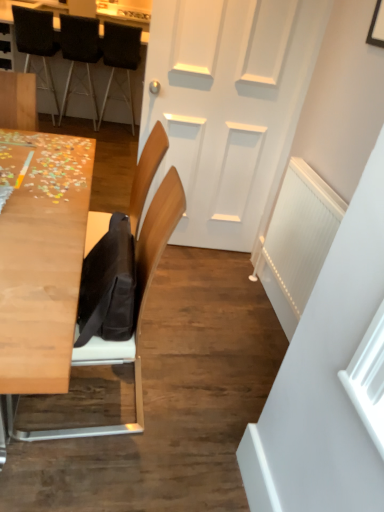
This screenshot has width=384, height=512. What do you see at coordinates (227, 105) in the screenshot?
I see `white matte door at center` at bounding box center [227, 105].

In the scene shown: Measure the distance between point (54, 231) and camera.

Point (54, 231) is 1.41 meters away from camera.

The image size is (384, 512). I want to click on white plastic radiator at right, so click(298, 241).

The height and width of the screenshot is (512, 384). In order to click on wooden puzzle pieces at upper left, the first table viewed from the top in this screenshot , I will do `click(79, 94)`.

What is the approximate height of wooden puzzle pieces at upper left, the first table viewed from the top?

The height of wooden puzzle pieces at upper left, the first table viewed from the top, is 37.06 inches.

The width and height of the screenshot is (384, 512). What are the coordinates of `white matte door at center` in the screenshot? It's located at (227, 105).

Is white plastic radiator at right at the back of wooden chair at left, which is counted as the fourth chair, starting from the back?

wooden chair at left, which is counted as the fourth chair, starting from the back, is not turned away from white plastic radiator at right.

Does point (146, 244) lie in front of point (325, 209)?

That is True.

From the image's perspective, which object appears higher, wooden chair at left, which is counted as the 1th chair, starting from the front, or white plastic radiator at right?

white plastic radiator at right is shown above in the image.

Is point (129, 80) closer or farther from the camera than point (57, 250)?

Point (129, 80).

Which object is wider, black fabric chair at upper left, which is the first chair from back to front, or light wood table at left, the 2th table viewed from the top?

Wider between the two is light wood table at left, the 2th table viewed from the top.

Starting from the light wood table at left, which appears as the 2th table when viewed from the back, which chair is the 1st one to the left? Please provide its 2D coordinates.

[(120, 58)]

Looking at this image, who is bigger, black fabric chair at upper left, positioned as the fourth chair in front-to-back order, or light wood table at left, the first table when ordered from bottom to top?

With larger size is light wood table at left, the first table when ordered from bottom to top.

Which object is wider, wooden chair at left, which is counted as the 1th chair, starting from the front, or black fabric chair at upper left, positioned as the fourth chair in front-to-back order?

black fabric chair at upper left, positioned as the fourth chair in front-to-back order.

Is wooden chair at left, which is counted as the 1th chair, starting from the front, oriented away from black fabric chair at upper left, which is the first chair from back to front?

wooden chair at left, which is counted as the 1th chair, starting from the front, does not have its back to black fabric chair at upper left, which is the first chair from back to front.

Is point (90, 355) closer or farther from the camera than point (112, 61)?

Point (90, 355) is closer to the camera than point (112, 61).

Is dark brown leather chair at upper left, which is counted as the 3th chair, starting from the back, directly adjacent to black fabric chair at upper left, positioned as the fourth chair in front-to-back order?

No, dark brown leather chair at upper left, which is counted as the 3th chair, starting from the back, is not beside black fabric chair at upper left, positioned as the fourth chair in front-to-back order.

Which is closer, (46, 71) or (118, 40)?

Point (46, 71) appears to be farther away from the viewer than point (118, 40).

From a real-world perspective, which object rests below the other?

dark brown leather chair at upper left, which is counted as the 3th chair, starting from the back, from a real-world perspective.

From the image's perspective, is black fabric chair at upper left, positioned as the fourth chair in front-to-back order, positioned above or below wooden puzzle pieces at upper left, the 1th table when ordered from back to front?

Clearly, from the image's perspective, black fabric chair at upper left, positioned as the fourth chair in front-to-back order, is below wooden puzzle pieces at upper left, the 1th table when ordered from back to front.

Considering the sizes of black fabric chair at upper left, which is the first chair from back to front, and wooden puzzle pieces at upper left, which ranks as the second table in bottom-to-top order, in the image, is black fabric chair at upper left, which is the first chair from back to front, bigger or smaller than wooden puzzle pieces at upper left, which ranks as the second table in bottom-to-top order,?

Considering their sizes, black fabric chair at upper left, which is the first chair from back to front, takes up less space than wooden puzzle pieces at upper left, which ranks as the second table in bottom-to-top order.

Are black fabric chair at upper left, which is the first chair from back to front, and wooden puzzle pieces at upper left, the 1th table when ordered from back to front, far apart?

No, black fabric chair at upper left, which is the first chair from back to front, is not far from wooden puzzle pieces at upper left, the 1th table when ordered from back to front.

Between black fabric chair at upper left, which is the first chair from back to front, and wooden puzzle pieces at upper left, the 1th table when ordered from back to front, which one is positioned in front?

black fabric chair at upper left, which is the first chair from back to front, is closer to the camera.

Is light wood table at left, the first table when ordered from bottom to top, at the back of wooden chair at left, which is counted as the 1th chair, starting from the front?

No, wooden chair at left, which is counted as the 1th chair, starting from the front,'s orientation is not away from light wood table at left, the first table when ordered from bottom to top.

Which is more to the left, wooden chair at left, which is counted as the 1th chair, starting from the front, or light wood table at left, the first table when ordered from bottom to top?

Positioned to the left is light wood table at left, the first table when ordered from bottom to top.

From the image's perspective, which one is positioned higher, wooden chair at left, which is counted as the 1th chair, starting from the front, or light wood table at left, the 2th table viewed from the top?

light wood table at left, the 2th table viewed from the top, is shown above in the image.

Is wooden chair at left, which is counted as the 1th chair, starting from the front, located outside light wood table at left, which appears as the 2th table when viewed from the back?

wooden chair at left, which is counted as the 1th chair, starting from the front, lies outside light wood table at left, which appears as the 2th table when viewed from the back,'s area.

Is point (103, 40) in front of point (291, 297)?

No, it is behind (291, 297).

Are black fabric chair at upper left, which is the first chair from back to front, and white plastic radiator at right located far from each other?

Indeed, black fabric chair at upper left, which is the first chair from back to front, is not near white plastic radiator at right.

How many degrees apart are the facing directions of black fabric chair at upper left, positioned as the fourth chair in front-to-back order, and white plastic radiator at right?

The angle between the facing direction of black fabric chair at upper left, positioned as the fourth chair in front-to-back order, and the facing direction of white plastic radiator at right is 90.3 degrees.

Based on the photo, can you confirm if black fabric chair at upper left, which is the first chair from back to front, is bigger than white plastic radiator at right?

Yes.

This screenshot has height=512, width=384. I want to click on chair that is below the white plastic radiator at right (from the image's perspective), so click(x=135, y=314).

In order to click on the 1st chair positioned above the light wood table at left, the 1th table when ordered from front to back (from the image's perspective) in this screenshot , I will do `click(120, 58)`.

When comparing their distances from light wood table at left, the 1th table when ordered from front to back, does white matte door at center or dark brown leather chair at upper left, which is counted as the 3th chair, starting from the back, seem closer?

Based on the image, white matte door at center appears to be nearer to light wood table at left, the 1th table when ordered from front to back.

Which object lies nearer to the anchor point black fabric chair at upper left, positioned as the fourth chair in front-to-back order, wooden chair at left, which is counted as the fourth chair, starting from the back, or white matte door at center?

white matte door at center is positioned closer to the anchor black fabric chair at upper left, positioned as the fourth chair in front-to-back order.

Estimate the real-world distances between objects in this image. Which object is closer to light wood table at left, the 1th table when ordered from front to back, white plastic radiator at right or wooden chair at left, which is counted as the fourth chair, starting from the back?

Based on the image, wooden chair at left, which is counted as the fourth chair, starting from the back, appears to be nearer to light wood table at left, the 1th table when ordered from front to back.

When comparing their distances from white plastic radiator at right, does wooden chair at left, which is counted as the fourth chair, starting from the back, or wooden puzzle pieces at upper left, the 1th table when ordered from back to front, seem closer?

wooden chair at left, which is counted as the fourth chair, starting from the back, is positioned closer to the anchor white plastic radiator at right.

When comparing their distances from light wood table at left, the 2th table viewed from the top, does wooden puzzle pieces at upper left, the 1th table when ordered from back to front, or black fabric chair at upper left, the third chair in the front-to-back sequence, seem closer?

black fabric chair at upper left, the third chair in the front-to-back sequence, is closer to light wood table at left, the 2th table viewed from the top.

Considering their positions, is white matte door at center positioned further to dark brown leather chair at upper left, which is counted as the 3th chair, starting from the back, than white plastic radiator at right?

white plastic radiator at right is further to dark brown leather chair at upper left, which is counted as the 3th chair, starting from the back.

Looking at the image, which one is located closer to dark brown leather chair at upper left, the 2th chair from the front, black fabric chair at upper left, positioned as the 2th chair in back-to-front order, or white matte door at center?

black fabric chair at upper left, positioned as the 2th chair in back-to-front order, lies closer to dark brown leather chair at upper left, the 2th chair from the front, than the other object.

When comparing their distances from white plastic radiator at right, does white matte door at center or dark brown leather chair at upper left, which is counted as the 3th chair, starting from the back, seem further?

dark brown leather chair at upper left, which is counted as the 3th chair, starting from the back, is positioned further to the anchor white plastic radiator at right.

You are a GUI agent. You are given a task and a screenshot of the screen. Output one action in this format:
    pyautogui.click(x=<x>, y=<y>)
    Task: Click on the door between light wood table at left, the 1th table when ordered from front to back, and wooden puzzle pieces at upper left, the 1th table when ordered from back to front, along the z-axis
    The width and height of the screenshot is (384, 512).
    Given the screenshot: What is the action you would take?
    [x=227, y=105]

I want to click on door located between light wood table at left, the first table when ordered from bottom to top, and black fabric chair at upper left, which is the first chair from back to front, in the depth direction, so click(x=227, y=105).

At what (x,y) coordinates should I click in order to perform the action: click on door located between light wood table at left, the 2th table viewed from the top, and dark brown leather chair at upper left, which is counted as the 3th chair, starting from the back, in the depth direction. Please return your answer as a coordinate pair (x, y). Looking at the image, I should click on (227, 105).

The height and width of the screenshot is (512, 384). I want to click on door located between white plastic radiator at right and dark brown leather chair at upper left, the 2th chair from the front, in the depth direction, so click(x=227, y=105).